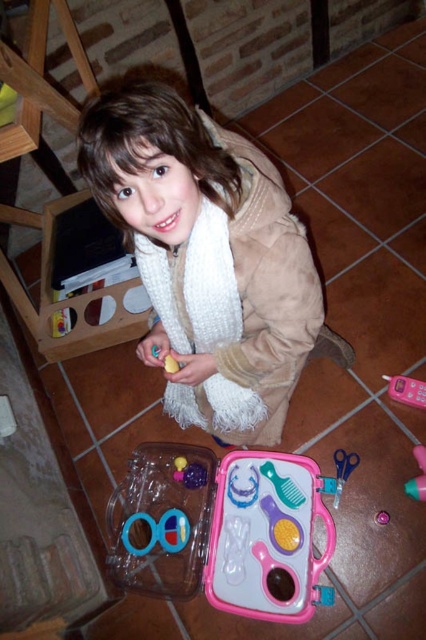
Can you confirm if white fuzzy scarf at center is thinner than shiny purple plastic at center?

Incorrect, white fuzzy scarf at center's width is not less than shiny purple plastic at center's.

Find the location of a particular element. The image size is (426, 640). white fuzzy scarf at center is located at coordinates pyautogui.click(x=215, y=256).

Where is `white fuzzy scarf at center`? The image size is (426, 640). white fuzzy scarf at center is located at coordinates (215, 256).

Looking at this image, who is lower down, metallic scissors at lower center or matte yellow rubber at center?

Positioned lower is metallic scissors at lower center.

Can you confirm if metallic scissors at lower center is thinner than matte yellow rubber at center?

In fact, metallic scissors at lower center might be wider than matte yellow rubber at center.

Who is more forward, (351, 461) or (175, 364)?

Point (175, 364)

Find the location of a particular element. Image resolution: width=426 pixels, height=640 pixels. metallic scissors at lower center is located at coordinates (342, 470).

Where is `pink plastic toy phone at lower right`? pink plastic toy phone at lower right is located at coordinates (405, 390).

Who is positioned more to the left, pink plastic toy phone at lower right or metallic scissors at lower center?

metallic scissors at lower center

Between point (386, 380) and point (336, 490), which one is positioned in front?

Point (336, 490) is more forward.

Locate an element on the screen. pink plastic toy phone at lower right is located at coordinates (405, 390).